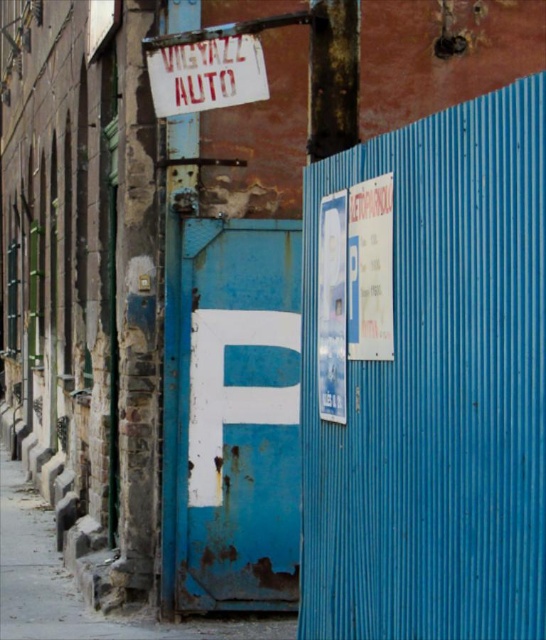
Question: Does rusty metal letter at center appear under rusty metal sign at upper center?

Choices:
 (A) no
 (B) yes

Answer: (B)

Question: Which of the following is the closest to the observer?

Choices:
 (A) (247, 500)
 (B) (187, 106)

Answer: (B)

Question: Can you confirm if rusty metal letter at center is smaller than rusty metal sign at upper center?

Choices:
 (A) no
 (B) yes

Answer: (A)

Question: Which point is farther to the camera?

Choices:
 (A) (219, 67)
 (B) (292, 372)

Answer: (B)

Question: Is rusty metal letter at center to the left of rusty metal sign at upper center from the viewer's perspective?

Choices:
 (A) yes
 (B) no

Answer: (B)